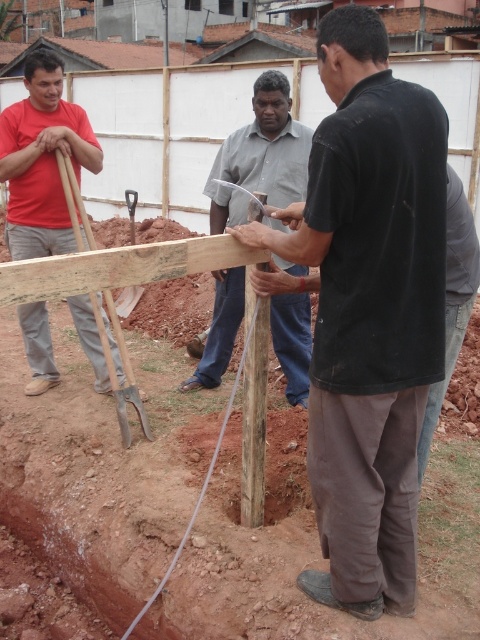
Who is higher up, black matte shirt at center or matte red shirt at left?

Positioned higher is matte red shirt at left.

Identify the location of black matte shirt at center. (369, 310).

From the picture: Is black matte shirt at center bigger than smooth gray shirt at center?

Yes, black matte shirt at center is bigger than smooth gray shirt at center.

Which is in front, point (244, 228) or point (241, 209)?

Positioned in front is point (244, 228).

Find the location of a particular element. black matte shirt at center is located at coordinates (369, 310).

Is matte red shirt at left above smooth gray shirt at center?

Yes, matte red shirt at left is above smooth gray shirt at center.

Which is above, matte red shirt at left or smooth gray shirt at center?

matte red shirt at left is above.

Is point (95, 337) farther from viewer compared to point (267, 193)?

Yes.

Find the location of a particular element. Image resolution: width=480 pixels, height=640 pixels. matte red shirt at left is located at coordinates (43, 160).